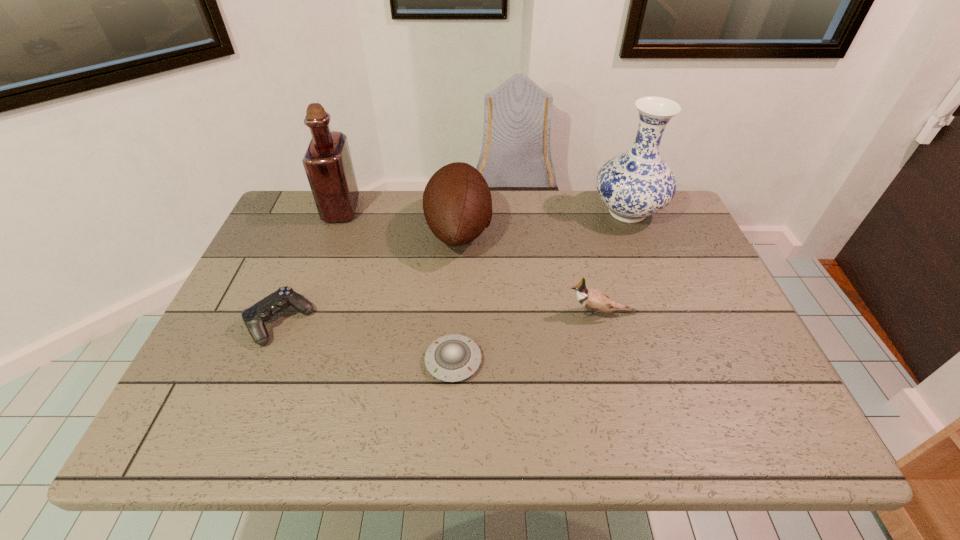
This screenshot has height=540, width=960. Identify the location of vacant region between the third shortest object and the football. (530, 272).

Locate an element on the screen. free spot between the third shortest object and the vase is located at coordinates (614, 263).

Find the location of `free space between the shortest object and the third tallest object`. free space between the shortest object and the third tallest object is located at coordinates (456, 295).

Find the location of a particular element. The width and height of the screenshot is (960, 540). vacant region between the football and the liquor is located at coordinates (400, 220).

Identify the location of empty location between the vase and the control. This screenshot has width=960, height=540. [x=454, y=267].

This screenshot has height=540, width=960. What are the coordinates of `free spot between the saucer and the third tallest object` in the screenshot? It's located at (456, 295).

This screenshot has width=960, height=540. I want to click on vacant area between the third tallest object and the saucer, so click(456, 295).

What are the coordinates of `empty space between the shortest object and the fifth tallest object` in the screenshot? It's located at (367, 342).

The image size is (960, 540). I want to click on object that is the third closest to the bird, so coord(635,184).

Identify which object is the third nearest to the football. Please provide its 2D coordinates. Your answer should be formatted as a tuple, i.e. [(x, y)], where the tuple contains the x and y coordinates of a point satisfying the conditions above.

[(451, 358)]